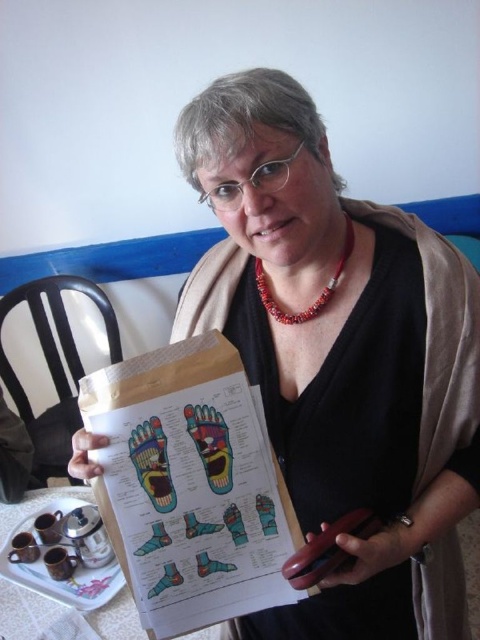
You are organizing a classroom and need to place the paperboard clipboard at center and the white ceramic tray at lower left on a shelf. If the shelf has limited space, which object should you place first to ensure both fit?

The paperboard clipboard at center is smaller than the white ceramic tray at lower left, so you should place the paperboard clipboard at center first to ensure both fit on the shelf.

You are an artist observing the scene. You need to draw the position of the black matte paper at center and the red coral necklace at center. Which object is located to the right side?

The black matte paper at center is to the right of the red coral necklace at center.

How far apart are the black matte paper at center and the red beaded necklace?

The black matte paper at center and the red beaded necklace are 24.29 inches apart.